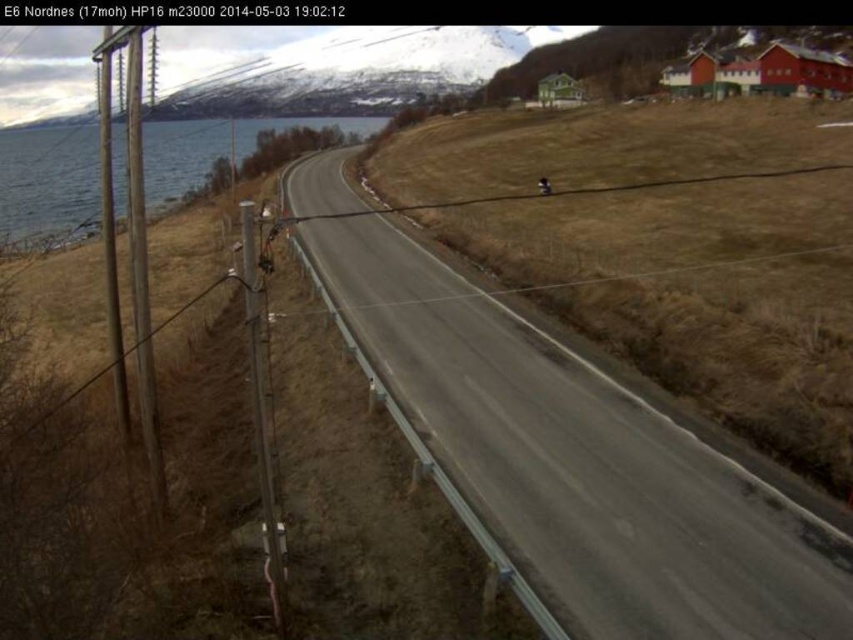
Question: Among these objects, which one is farthest from the camera?

Choices:
 (A) gray asphalt highway at center
 (B) blue water at left

Answer: (B)

Question: Is gray asphalt highway at center bigger than blue water at left?

Choices:
 (A) yes
 (B) no

Answer: (B)

Question: Which point is farther to the camera?

Choices:
 (A) (729, 611)
 (B) (18, 129)

Answer: (B)

Question: Is gray asphalt highway at center to the left of blue water at left from the viewer's perspective?

Choices:
 (A) no
 (B) yes

Answer: (A)

Question: Is gray asphalt highway at center below blue water at left?

Choices:
 (A) no
 (B) yes

Answer: (B)

Question: Which object appears farthest from the camera in this image?

Choices:
 (A) blue water at left
 (B) gray asphalt highway at center

Answer: (A)